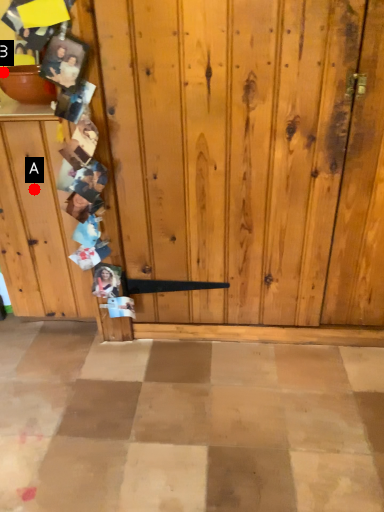
Question: Two points are circled on the image, labeled by A and B beside each circle. Which point appears closest to the camera in this image?

Choices:
 (A) A is closer
 (B) B is closer

Answer: (A)